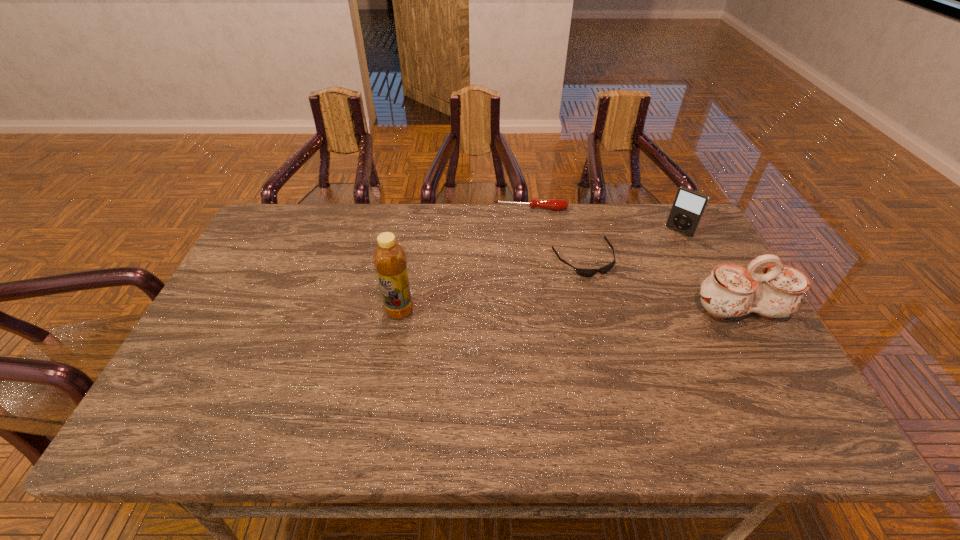
Locate an element on the screen. Image resolution: width=960 pixels, height=540 pixels. vacant space positioned 0.060m by the handle of the chinaware is located at coordinates (761, 348).

Identify the location of vacant space located 0.320m at the tip of the fourth tallest object. [526, 278].

Identify the location of vacant space located 0.170m at the tip of the fourth tallest object. pyautogui.click(x=527, y=245).

Locate an element on the screen. vacant space situated 0.250m at the tip of the fourth tallest object is located at coordinates pyautogui.click(x=527, y=262).

Find the location of a particular element. This screenshot has height=540, width=960. vacant space located 0.140m on the front-facing side of the third nearest object is located at coordinates pyautogui.click(x=620, y=312).

Locate an element on the screen. free space located 0.200m on the front-facing side of the third nearest object is located at coordinates (632, 328).

Locate an element on the screen. free space located 0.180m on the front-facing side of the third nearest object is located at coordinates (628, 322).

The height and width of the screenshot is (540, 960). What are the coordinates of `vacant position located on the front-facing side of the fourth nearest object` in the screenshot? It's located at (646, 268).

Locate an element on the screen. blank space located on the front-facing side of the fourth nearest object is located at coordinates (629, 289).

I want to click on vacant space located on the front-facing side of the fourth nearest object, so click(666, 246).